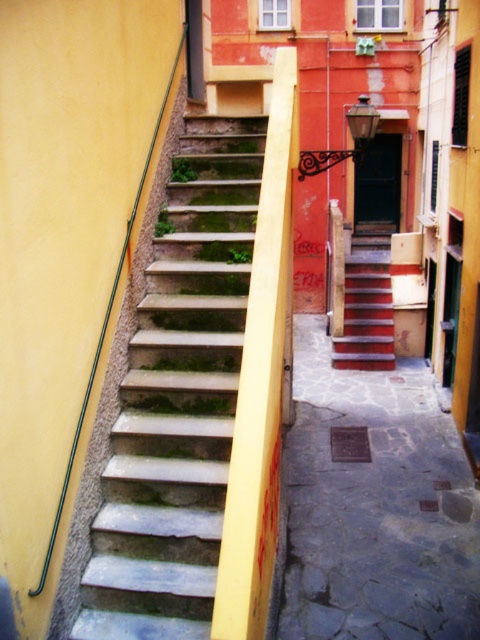
You are a delivery person carrying a large box that is 1 meter wide. You need to navigate through the narrow alleyway shown in the image. Can you pass through the stone steps at left or the smooth stone alley at center without tilting the box?

The stone steps at left has a lesser width compared to smooth stone alley at center, so the smooth stone alley at center is wider and can accommodate the 1 meter wide box without tilting.

You are a delivery person carrying a heavy box and need to climb the stone steps at left and wooden stairs at center. Which set of stairs should you choose to ensure you can carry the box comfortably?

The stone steps at left is larger in size than wooden stairs at center, so you should choose the stone steps at left because their larger steps provide more stable footing for carrying a heavy box.